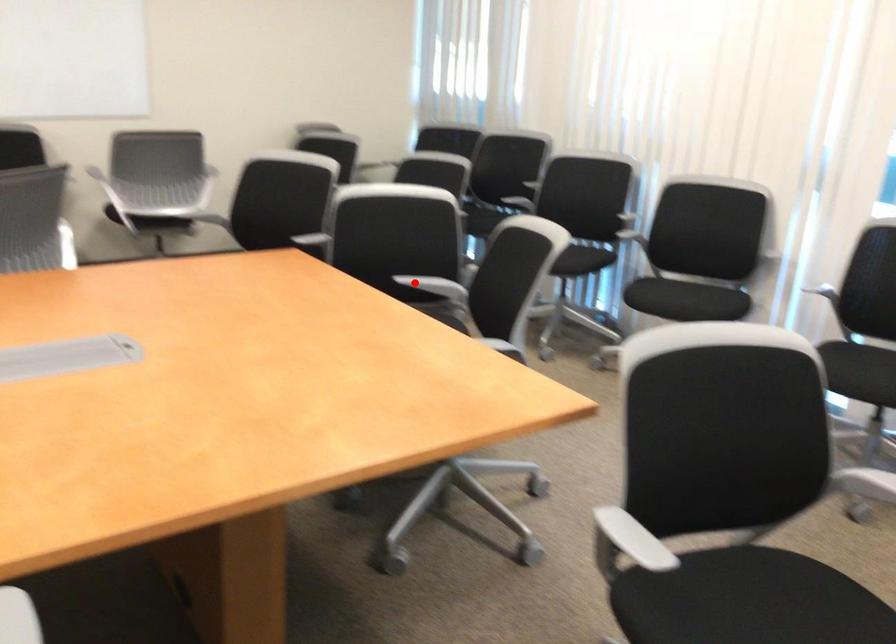
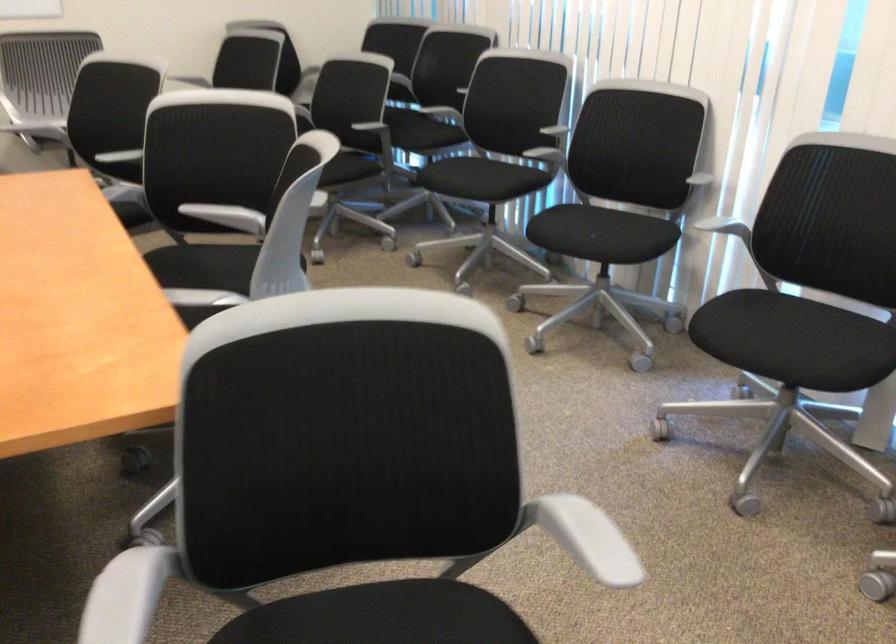
Question: I am providing you with two images of the same scene from different viewpoints. A red point is shown in image1. For the corresponding object point in image2, is it positioned nearer or farther from the camera?

Choices:
 (A) Nearer
 (B) Farther

Answer: (A)